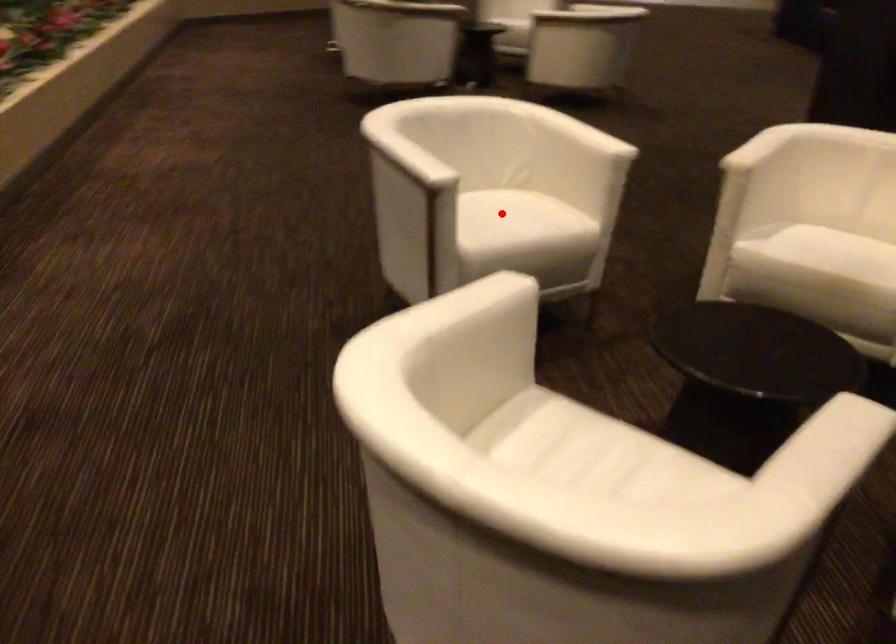
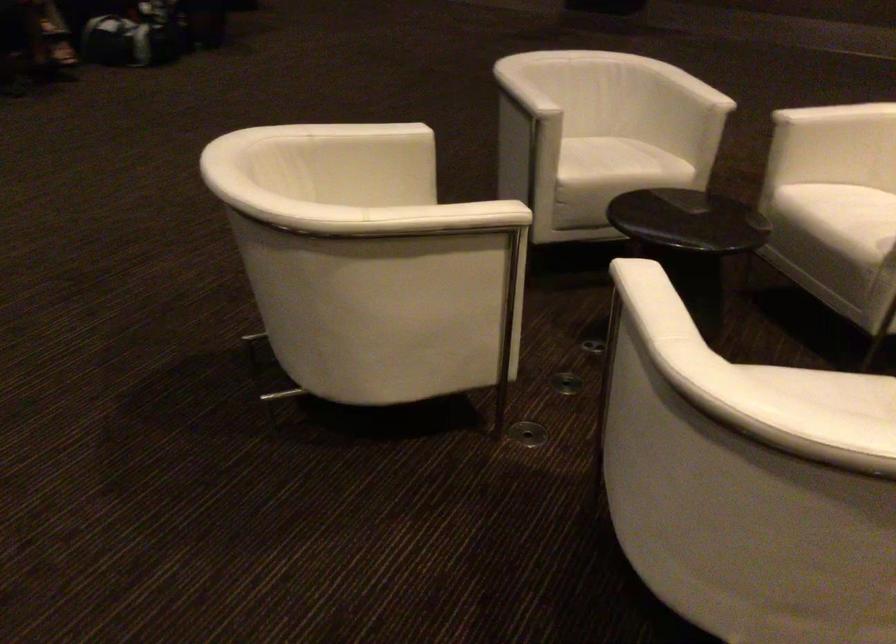
Question: I am providing you with two images of the same scene from different viewpoints. A red point is marked on the first image. At the location where the point appears in image 1, is it still visible in image 2?

Choices:
 (A) Yes
 (B) No

Answer: (B)